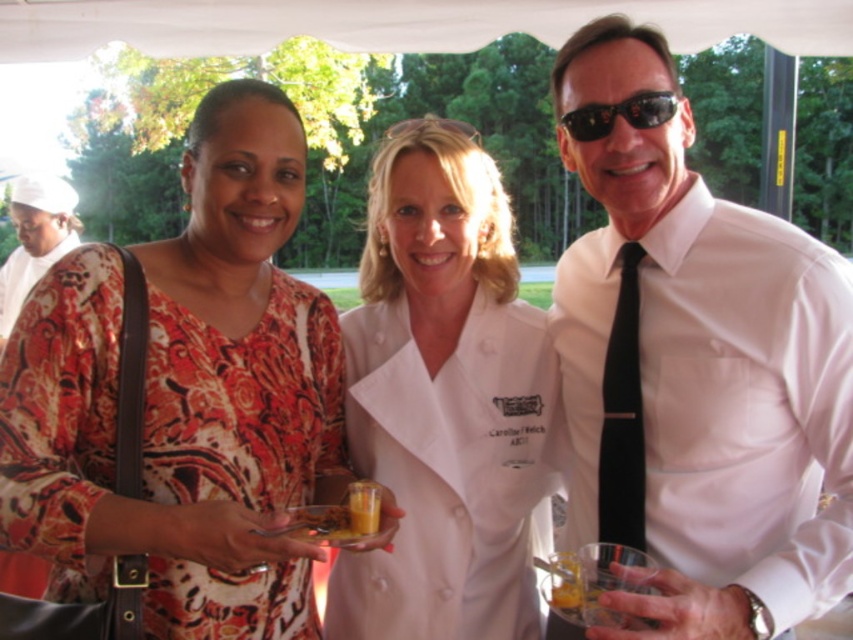
Question: Which object is closer to the camera taking this photo?

Choices:
 (A) white shirt at center
 (B) translucent glass cup at center

Answer: (A)

Question: In this image, where is printed silk blouse at center located relative to white chef coat at center?

Choices:
 (A) right
 (B) left

Answer: (B)

Question: Among these objects, which one is farthest from the camera?

Choices:
 (A) translucent glass cup at center
 (B) black plastic sunglasses at upper right

Answer: (B)

Question: Is black silk tie at right in front of translucent glass cup at center?

Choices:
 (A) yes
 (B) no

Answer: (A)

Question: Estimate the real-world distances between objects in this image. Which object is farther from the printed silk blouse at center?

Choices:
 (A) white chef coat at center
 (B) black silk tie at right
 (C) black plastic sunglasses at upper right
 (D) white shirt at center

Answer: (C)

Question: In this image, where is white shirt at center located relative to translucent glass cup at center?

Choices:
 (A) below
 (B) above

Answer: (B)